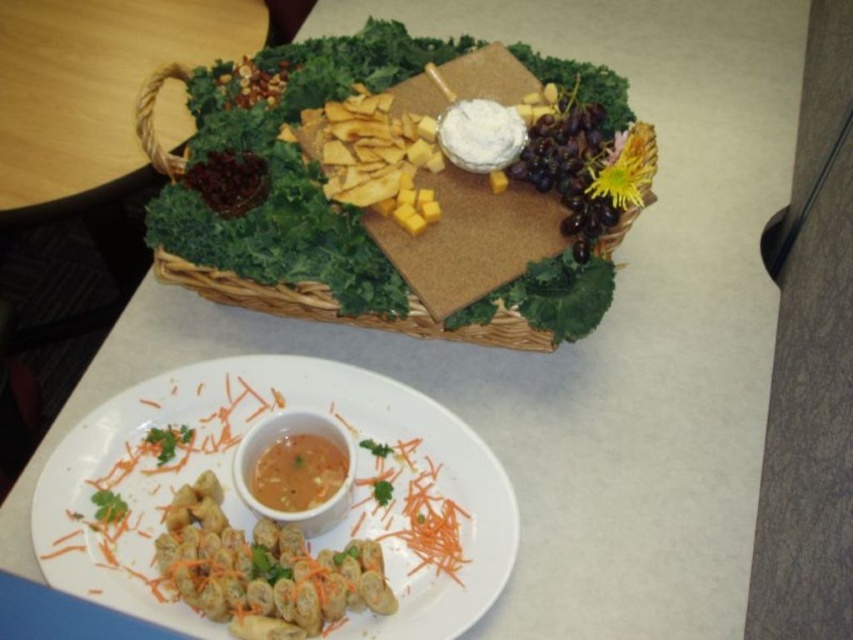
Does matte orange dip at center lie in front of smooth orange sauce at center?

Yes, it is in front of smooth orange sauce at center.

At what (x,y) coordinates should I click in order to perform the action: click on matte orange dip at center. Please return your answer as a coordinate pair (x, y). This screenshot has height=640, width=853. Looking at the image, I should click on (281, 438).

Is savory brown roll at center wider than matte orange dip at center?

Indeed, savory brown roll at center has a greater width compared to matte orange dip at center.

Does savory brown roll at center have a greater height compared to matte orange dip at center?

Yes.

Is point (293, 637) farther from camera compared to point (306, 417)?

No, it is in front of (306, 417).

What are the coordinates of `savory brown roll at center` in the screenshot? It's located at (263, 570).

Does savory brown roll at center have a lesser width compared to smooth orange sauce at center?

No.

Is point (165, 572) positioned after point (273, 509)?

That is False.

Locate an element on the screen. Image resolution: width=853 pixels, height=640 pixels. savory brown roll at center is located at coordinates (263, 570).